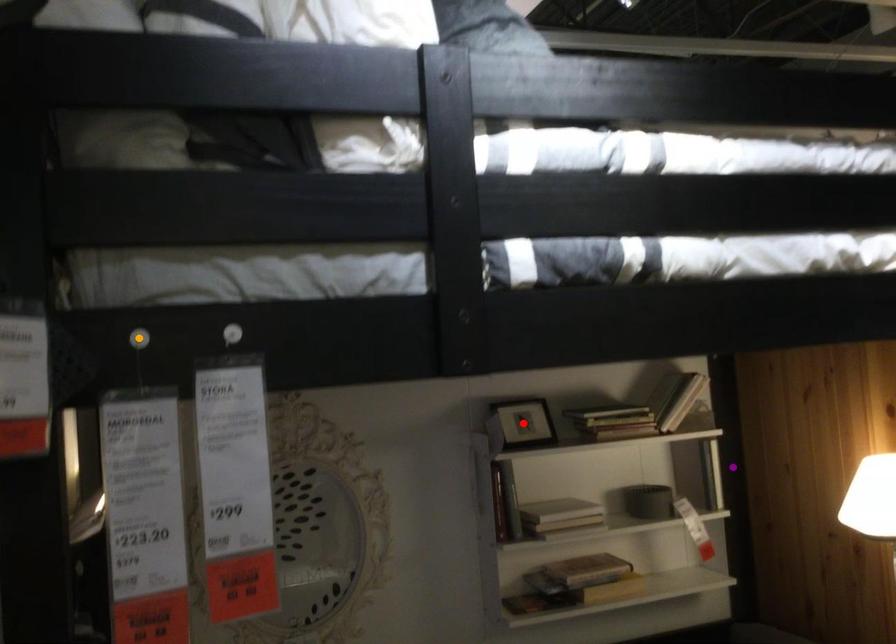
Order these from nearest to farthest:
A) orange point
B) purple point
C) red point

1. purple point
2. red point
3. orange point